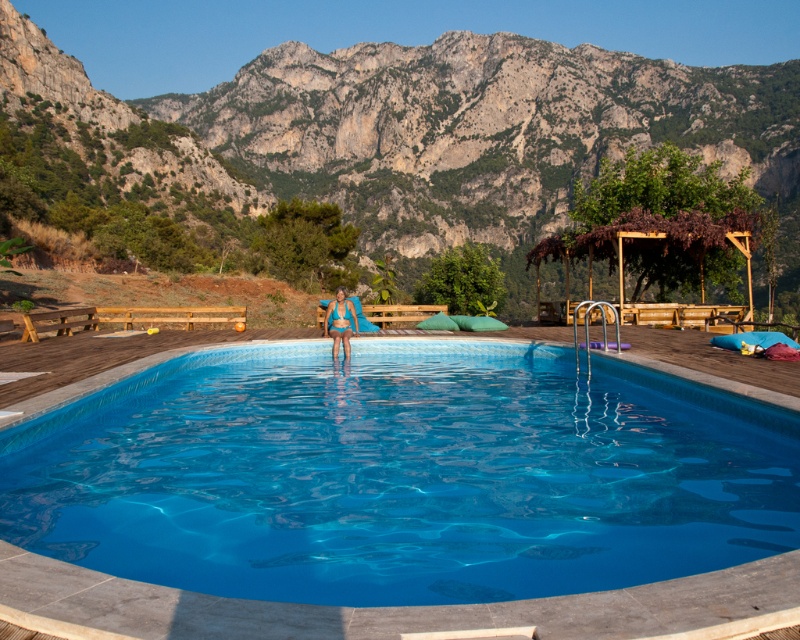
Question: Is rugged stone mountain at upper center thinner than blue fabric at center?

Choices:
 (A) no
 (B) yes

Answer: (A)

Question: Is blue tile swimming pool at center above blue fabric at center?

Choices:
 (A) yes
 (B) no

Answer: (B)

Question: Among these objects, which one is farthest from the camera?

Choices:
 (A) blue tile swimming pool at center
 (B) blue fabric at center

Answer: (B)

Question: Is rugged stone mountain at upper center to the right of blue fabric at center from the viewer's perspective?

Choices:
 (A) no
 (B) yes

Answer: (A)

Question: Among these points, which one is farthest from the camera?

Choices:
 (A) (348, 321)
 (B) (504, 592)

Answer: (A)

Question: Estimate the real-world distances between objects in this image. Which object is closer to the rugged stone mountain at upper center?

Choices:
 (A) blue tile swimming pool at center
 (B) blue fabric at center

Answer: (A)